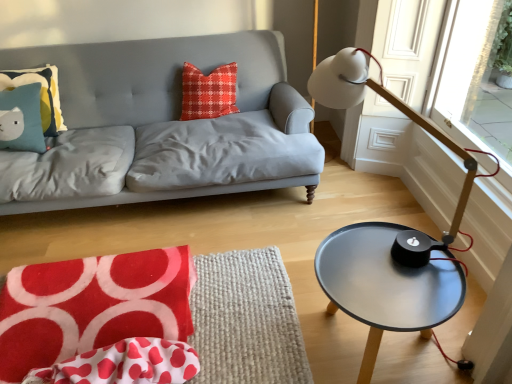
The height and width of the screenshot is (384, 512). Identify the location of red plaid pillow at center, which is the 2th pillow in left-to-right order. (208, 92).

The height and width of the screenshot is (384, 512). Describe the element at coordinates (40, 94) in the screenshot. I see `matte blue pillow with cat design at upper left, which is the first pillow in left-to-right order` at that location.

Identify the location of velvety red swivel chair at lower left. (247, 320).

The height and width of the screenshot is (384, 512). Identify the location of white polka dot fabric at lower left. (124, 364).

How far apart are white polka dot fabric at lower left and matte gray fabric couch at upper left?

They are 1.22 meters apart.

Visually, is white polka dot fabric at lower left positioned to the left or to the right of matte gray fabric couch at upper left?

Based on their positions, white polka dot fabric at lower left is located to the right of matte gray fabric couch at upper left.

From a real-world perspective, who is located higher, white polka dot fabric at lower left or matte gray fabric couch at upper left?

In real-world perspective, matte gray fabric couch at upper left is above.

Is point (112, 370) positioned in front of point (128, 47)?

Yes, it is.

How far apart are white matte table lamp at right and red plaid pillow at center, which is the 2th pillow in left-to-right order?

They are 1.37 meters apart.

Is white matte table lamp at right far from red plaid pillow at center, which is the 2th pillow in left-to-right order?

Yes, white matte table lamp at right and red plaid pillow at center, which is the 2th pillow in left-to-right order, are quite far apart.

Which is behind, point (309, 82) or point (185, 62)?

Point (309, 82)

What's the angular difference between white matte table lamp at right and red plaid pillow at center, which is the 2th pillow in left-to-right order,'s facing directions?

88 degrees separate the facing orientations of white matte table lamp at right and red plaid pillow at center, which is the 2th pillow in left-to-right order.

Is metallic gray table at right next to matte blue pillow with cat design at upper left, which is the second pillow from right to left?

No, metallic gray table at right is not with matte blue pillow with cat design at upper left, which is the second pillow from right to left.

Is metallic gray table at right thinner than matte blue pillow with cat design at upper left, which is the first pillow in left-to-right order?

In fact, metallic gray table at right might be wider than matte blue pillow with cat design at upper left, which is the first pillow in left-to-right order.

Where is `coffee table on the right of matte blue pillow with cat design at upper left, which is the first pillow in left-to-right order`? This screenshot has height=384, width=512. coffee table on the right of matte blue pillow with cat design at upper left, which is the first pillow in left-to-right order is located at coordinates (385, 285).

Does matte gray fabric couch at upper left appear on the right side of metallic gray table at right?

In fact, matte gray fabric couch at upper left is to the left of metallic gray table at right.

In the scene shown: From a real-world perspective, is matte gray fabric couch at upper left located higher than metallic gray table at right?

Yes, from a real-world perspective, matte gray fabric couch at upper left is on top of metallic gray table at right.

Which of these two, matte gray fabric couch at upper left or metallic gray table at right, is wider?

With larger width is matte gray fabric couch at upper left.

The width and height of the screenshot is (512, 384). In the image, there is a metallic gray table at right. Identify the location of studio couch above it (from the image's perspective). (162, 126).

From a real-world perspective, is matte blue pillow with cat design at upper left, which is the first pillow in left-to-right order, physically located above or below velvety red swivel chair at lower left?

From a real-world perspective, matte blue pillow with cat design at upper left, which is the first pillow in left-to-right order, is physically above velvety red swivel chair at lower left.

Considering the relative sizes of matte blue pillow with cat design at upper left, which is the second pillow from right to left, and velvety red swivel chair at lower left in the image provided, is matte blue pillow with cat design at upper left, which is the second pillow from right to left, shorter than velvety red swivel chair at lower left?

No.

Between point (58, 112) and point (214, 287), which one is positioned in front?

The point (214, 287) is closer.

Could you tell me if matte blue pillow with cat design at upper left, which is the second pillow from right to left, is facing velvety red swivel chair at lower left?

No, matte blue pillow with cat design at upper left, which is the second pillow from right to left, is not oriented towards velvety red swivel chair at lower left.

Based on their sizes in the image, would you say red plaid pillow at center, the first pillow positioned from the right, is bigger or smaller than velvety red swivel chair at lower left?

red plaid pillow at center, the first pillow positioned from the right, is smaller than velvety red swivel chair at lower left.

You are a GUI agent. You are given a task and a screenshot of the screen. Output one action in this format:
    pyautogui.click(x=<x>, y=<y>)
    Task: Click on the swivel chair below the red plaid pillow at center, the first pillow positioned from the right (from a real-world perspective)
    This screenshot has height=384, width=512.
    Given the screenshot: What is the action you would take?
    pyautogui.click(x=247, y=320)

Does red plaid pillow at center, the first pillow positioned from the right, appear on the left side of velvety red swivel chair at lower left?

In fact, red plaid pillow at center, the first pillow positioned from the right, is to the right of velvety red swivel chair at lower left.

Does matte gray fabric couch at upper left have a greater height compared to white polka dot fabric at lower left?

Indeed, matte gray fabric couch at upper left has a greater height compared to white polka dot fabric at lower left.

From a real-world perspective, who is located higher, matte gray fabric couch at upper left or white polka dot fabric at lower left?

From a 3D spatial view, matte gray fabric couch at upper left is above.

Considering the relative sizes of matte gray fabric couch at upper left and white polka dot fabric at lower left in the image provided, is matte gray fabric couch at upper left smaller than white polka dot fabric at lower left?

No, matte gray fabric couch at upper left is not smaller than white polka dot fabric at lower left.

Choose the correct answer: Is matte gray fabric couch at upper left inside white polka dot fabric at lower left or outside it?

matte gray fabric couch at upper left is outside white polka dot fabric at lower left.

This screenshot has height=384, width=512. Find the location of `studio couch behind the white polka dot fabric at lower left`. studio couch behind the white polka dot fabric at lower left is located at coordinates (162, 126).

Where is `table lamp in front of the red plaid pillow at center, the first pillow positioned from the right`? The width and height of the screenshot is (512, 384). table lamp in front of the red plaid pillow at center, the first pillow positioned from the right is located at coordinates (395, 107).

Looking at the image, which one is located further to matte blue pillow with cat design at upper left, which is the first pillow in left-to-right order, matte gray fabric couch at upper left or red plaid pillow at center, which is the 2th pillow in left-to-right order?

red plaid pillow at center, which is the 2th pillow in left-to-right order.

Based on their spatial positions, is velvety red swivel chair at lower left or matte blue pillow with cat design at upper left, which is the first pillow in left-to-right order, further from white matte table lamp at right?

Based on the image, matte blue pillow with cat design at upper left, which is the first pillow in left-to-right order, appears to be further to white matte table lamp at right.

From the image, which object appears to be farther from velvety red swivel chair at lower left, white matte table lamp at right or matte blue pillow with cat design at upper left, which is the second pillow from right to left?

matte blue pillow with cat design at upper left, which is the second pillow from right to left.

Looking at the image, which one is located further to matte gray fabric couch at upper left, red plaid pillow at center, the first pillow positioned from the right, or white polka dot fabric at lower left?

Among the two, white polka dot fabric at lower left is located further to matte gray fabric couch at upper left.

Considering their positions, is matte gray fabric couch at upper left positioned further to white polka dot fabric at lower left than velvety red swivel chair at lower left?

The object further to white polka dot fabric at lower left is matte gray fabric couch at upper left.

Looking at the image, which one is located closer to metallic gray table at right, white polka dot fabric at lower left or red plaid pillow at center, which is the 2th pillow in left-to-right order?

The object closer to metallic gray table at right is white polka dot fabric at lower left.

Looking at the image, which one is located further to metallic gray table at right, matte blue pillow with cat design at upper left, which is the second pillow from right to left, or red plaid pillow at center, which is the 2th pillow in left-to-right order?

The object further to metallic gray table at right is matte blue pillow with cat design at upper left, which is the second pillow from right to left.

Considering their positions, is white polka dot fabric at lower left positioned further to red plaid pillow at center, the first pillow positioned from the right, than matte blue pillow with cat design at upper left, which is the second pillow from right to left?

Among the two, white polka dot fabric at lower left is located further to red plaid pillow at center, the first pillow positioned from the right.

Identify the location of pillow between red plaid pillow at center, which is the 2th pillow in left-to-right order, and velvety red swivel chair at lower left from top to bottom. (40, 94).

You are a GUI agent. You are given a task and a screenshot of the screen. Output one action in this format:
    pyautogui.click(x=<x>, y=<y>)
    Task: Click on the swivel chair between matte blue pillow with cat design at upper left, which is the first pillow in left-to-right order, and metallic gray table at right, in the horizontal direction
    Image resolution: width=512 pixels, height=384 pixels.
    Given the screenshot: What is the action you would take?
    pyautogui.click(x=247, y=320)

The width and height of the screenshot is (512, 384). Find the location of `pillow between matte blue pillow with cat design at upper left, which is the first pillow in left-to-right order, and white matte table lamp at right, in the horizontal direction`. pillow between matte blue pillow with cat design at upper left, which is the first pillow in left-to-right order, and white matte table lamp at right, in the horizontal direction is located at coordinates (208, 92).

Where is `studio couch between matte blue pillow with cat design at upper left, which is the second pillow from right to left, and metallic gray table at right from left to right`? Image resolution: width=512 pixels, height=384 pixels. studio couch between matte blue pillow with cat design at upper left, which is the second pillow from right to left, and metallic gray table at right from left to right is located at coordinates (162, 126).